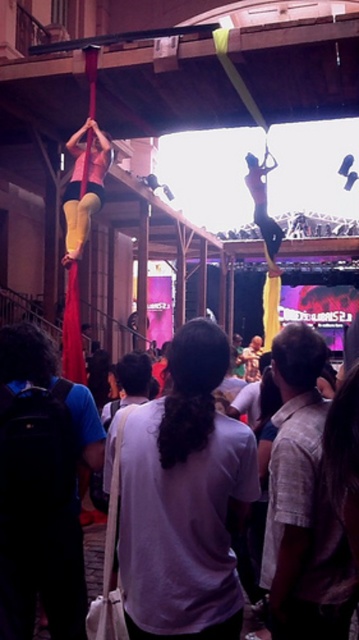
You are a photographer at the event and want to capture both the white cotton shirt at center and the matte yellow leggings at left in a single photo. Which object should you focus on first to ensure both are in frame?

You should focus on the white cotton shirt at center first because it is larger in size compared to the matte yellow leggings at left, ensuring it fits within the frame while the smaller object remains visible.

You are a photographer trying to capture a clear photo of the white cotton shirt at center and the skinny white pole at upper center. Which object should you focus on first to ensure both are in the frame?

The white cotton shirt at center is positioned under the skinny white pole at upper center, so you should focus on the white cotton shirt at center first to ensure both are in the frame.

You are a photographer positioned at the center of the crowd. You want to take a photo of the performer with the matte yellow leggings at left. Where should you aim your camera relative to your current position?

The matte yellow leggings at left is located at point (x=86, y=188), so you should aim your camera to the left and slightly downward from your current position to capture the performer.